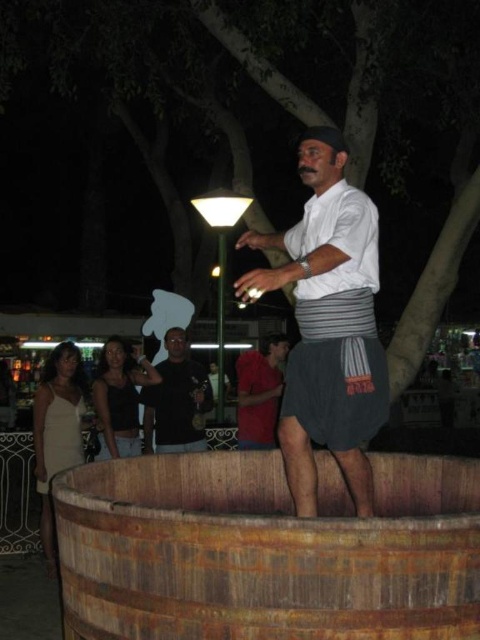
Question: Can you confirm if black matte shirt at center is positioned to the left of red cotton shirt at center?

Choices:
 (A) yes
 (B) no

Answer: (A)

Question: Considering the relative positions of white cotton shirt at center and white satin dress at lower left in the image provided, where is white cotton shirt at center located with respect to white satin dress at lower left?

Choices:
 (A) below
 (B) above

Answer: (B)

Question: Which is nearer to the black matte shirt at center?

Choices:
 (A) white satin dress at lower left
 (B) red cotton shirt at center
 (C) rusty wood barrel at lower center
 (D) white cotton shirt at center

Answer: (B)

Question: Is white cotton shirt at center positioned at the back of black matte shirt at center?

Choices:
 (A) no
 (B) yes

Answer: (A)

Question: Which point is farther from the camera taking this photo?

Choices:
 (A) [277, 362]
 (B) [317, 563]
 (C) [109, 426]

Answer: (A)

Question: Based on their relative distances, which object is nearer to the rusty wood barrel at lower center?

Choices:
 (A) red cotton shirt at center
 (B) black matte shirt at center

Answer: (A)